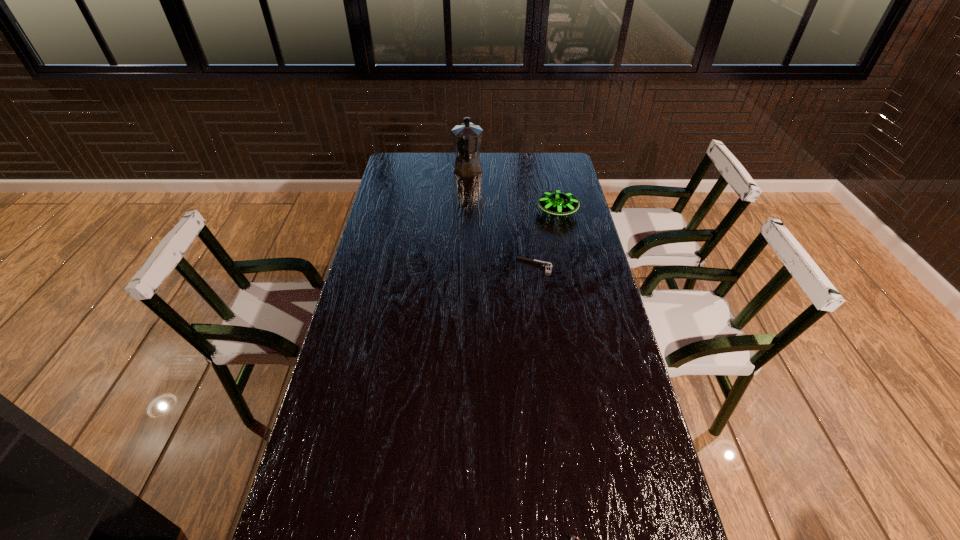
What are the coordinates of `the tallest object` in the screenshot? It's located at (467, 137).

The width and height of the screenshot is (960, 540). In order to click on the leftmost object in this screenshot , I will do `click(467, 137)`.

You are a GUI agent. You are given a task and a screenshot of the screen. Output one action in this format:
    pyautogui.click(x=<x>, y=<y>)
    Task: Click on the second farthest object
    
    Given the screenshot: What is the action you would take?
    pyautogui.click(x=556, y=202)

The width and height of the screenshot is (960, 540). In order to click on saucer in this screenshot , I will do `click(556, 202)`.

You are a GUI agent. You are given a task and a screenshot of the screen. Output one action in this format:
    pyautogui.click(x=<x>, y=<y>)
    Task: Click on the pistol
    
    Given the screenshot: What is the action you would take?
    pyautogui.click(x=547, y=265)

I want to click on the shortest object, so click(547, 265).

I want to click on free space located on the back of the saucer, so click(x=547, y=163).

Where is `free space located on the front-facing side of the shortest object`? free space located on the front-facing side of the shortest object is located at coordinates (418, 265).

At what (x,y) coordinates should I click in order to perform the action: click on vacant space located 0.390m on the front-facing side of the shortest object. Please return your answer as a coordinate pair (x, y). The width and height of the screenshot is (960, 540). Looking at the image, I should click on (409, 265).

Find the location of a particular element. This screenshot has width=960, height=540. vacant space located 0.070m on the front-facing side of the shortest object is located at coordinates (497, 265).